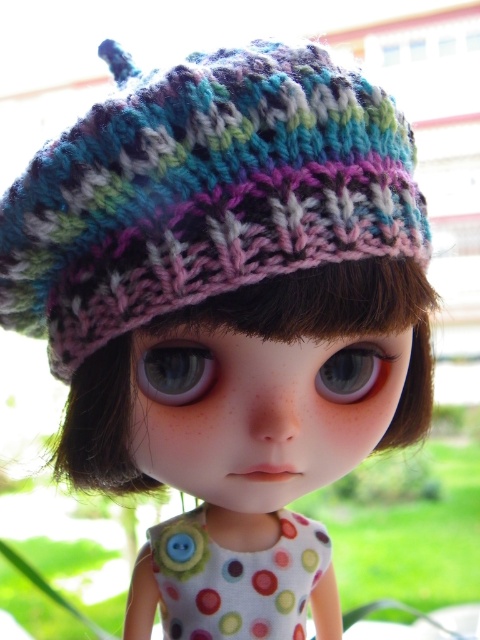
Is brown matte eye at center bigger than blue glossy eye at center?

No.

Identify the location of brown matte eye at center. This screenshot has height=640, width=480. (175, 372).

This screenshot has height=640, width=480. Identify the location of brown matte eye at center. (175, 372).

Can you confirm if polka dot fabric dress at center is positioned above brown matte eye at center?

Incorrect, polka dot fabric dress at center is not positioned above brown matte eye at center.

The height and width of the screenshot is (640, 480). I want to click on polka dot fabric dress at center, so click(236, 579).

Is polka dot fabric dress at center to the left of blue glossy eye at center from the viewer's perspective?

Yes, polka dot fabric dress at center is to the left of blue glossy eye at center.

Which is behind, point (184, 547) or point (377, 364)?

The point (184, 547) is behind.

I want to click on polka dot fabric dress at center, so click(236, 579).